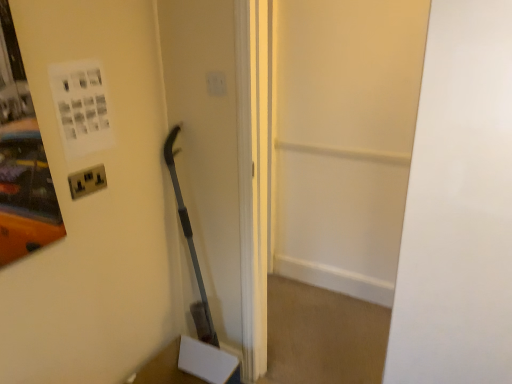
Question: Is transparent glass door at center closer to the viewer compared to white plastic light switch at upper center?

Choices:
 (A) yes
 (B) no

Answer: (A)

Question: Considering the relative sizes of transparent glass door at center and white plastic light switch at upper center in the image provided, is transparent glass door at center shorter than white plastic light switch at upper center?

Choices:
 (A) no
 (B) yes

Answer: (A)

Question: Is transparent glass door at center positioned behind white plastic light switch at upper center?

Choices:
 (A) yes
 (B) no

Answer: (B)

Question: Considering the relative sizes of transparent glass door at center and white plastic light switch at upper center in the image provided, is transparent glass door at center taller than white plastic light switch at upper center?

Choices:
 (A) yes
 (B) no

Answer: (A)

Question: Is transparent glass door at center oriented towards white plastic light switch at upper center?

Choices:
 (A) yes
 (B) no

Answer: (B)

Question: From a real-world perspective, is metallic socket at left above or below white matte door at center?

Choices:
 (A) above
 (B) below

Answer: (A)

Question: Is point (74, 178) positioned closer to the camera than point (424, 235)?

Choices:
 (A) closer
 (B) farther

Answer: (B)

Question: Based on their positions, is metallic socket at left located to the left or right of white matte door at center?

Choices:
 (A) left
 (B) right

Answer: (A)

Question: Is metallic socket at left wider or thinner than white matte door at center?

Choices:
 (A) wide
 (B) thin

Answer: (B)

Question: Is point (218, 86) positioned closer to the camera than point (402, 294)?

Choices:
 (A) closer
 (B) farther

Answer: (B)

Question: From a real-world perspective, is white plastic light switch at upper center positioned above or below white matte door at center?

Choices:
 (A) above
 (B) below

Answer: (A)

Question: From the image's perspective, is white plastic light switch at upper center located above or below white matte door at center?

Choices:
 (A) below
 (B) above

Answer: (B)

Question: In terms of height, does white plastic light switch at upper center look taller or shorter compared to white matte door at center?

Choices:
 (A) short
 (B) tall

Answer: (A)

Question: Is white matte door at center situated inside transparent glass door at center or outside?

Choices:
 (A) outside
 (B) inside

Answer: (A)

Question: Looking at their shapes, would you say white matte door at center is wider or thinner than transparent glass door at center?

Choices:
 (A) wide
 (B) thin

Answer: (A)